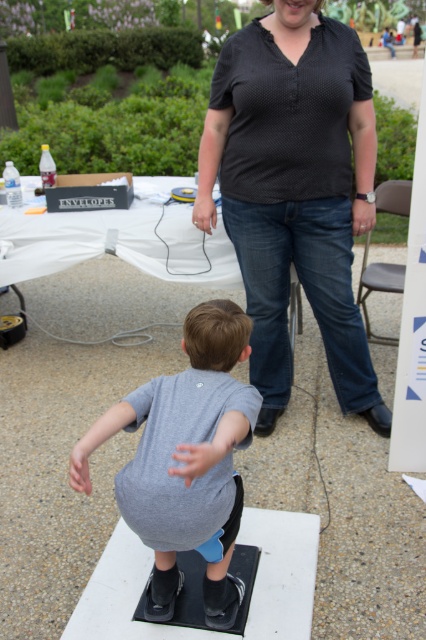
Can you confirm if black dotted shirt at center is positioned above gray matte shirt at center?

Indeed, black dotted shirt at center is positioned over gray matte shirt at center.

Is point (368, 417) positioned behind point (146, 515)?

Yes, point (368, 417) is farther from viewer.

Does point (360, 349) come closer to viewer compared to point (184, 333)?

No, (360, 349) is behind (184, 333).

This screenshot has height=640, width=426. Identify the location of black dotted shirt at center. (294, 192).